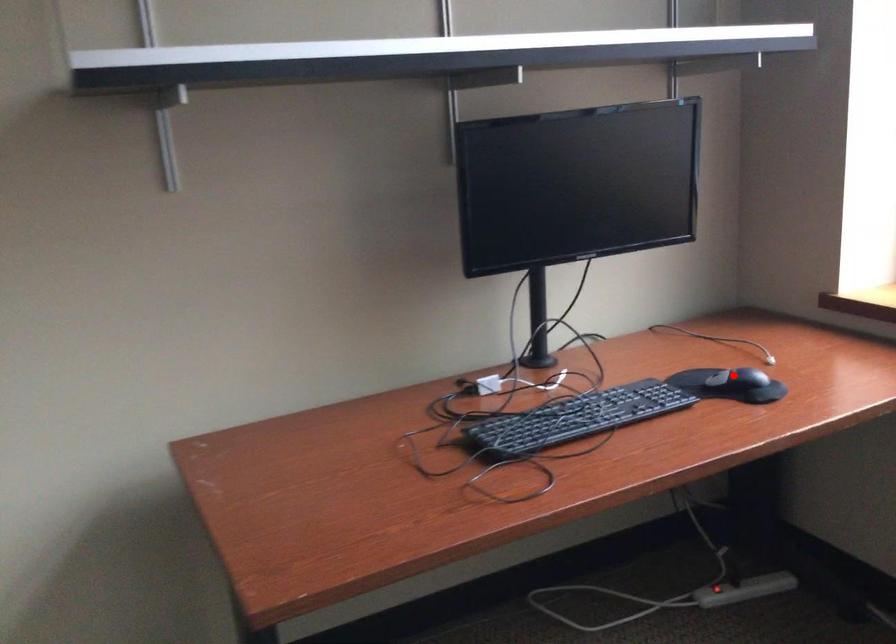
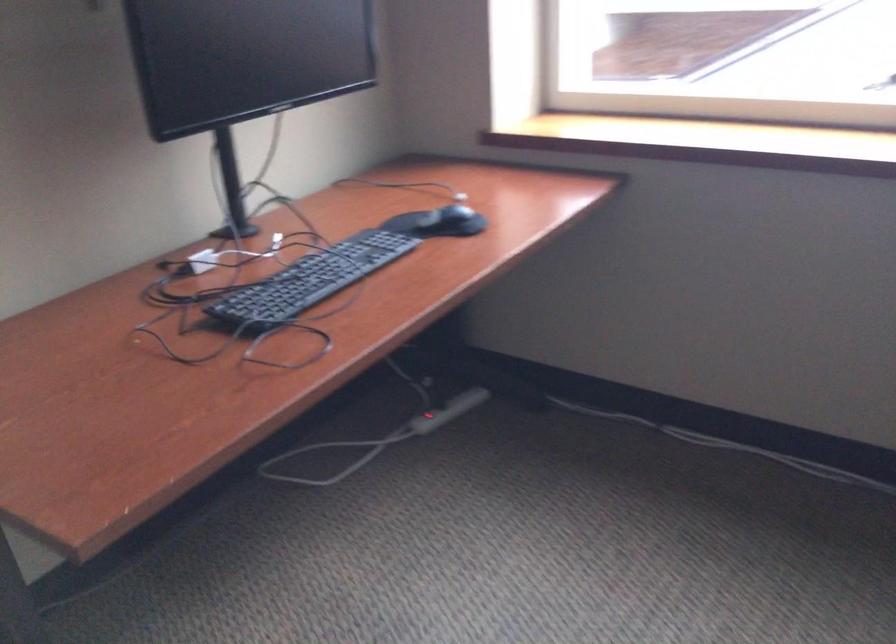
Locate, in the second image, the point that corresponds to the highlighted location in the first image.

(452, 212)